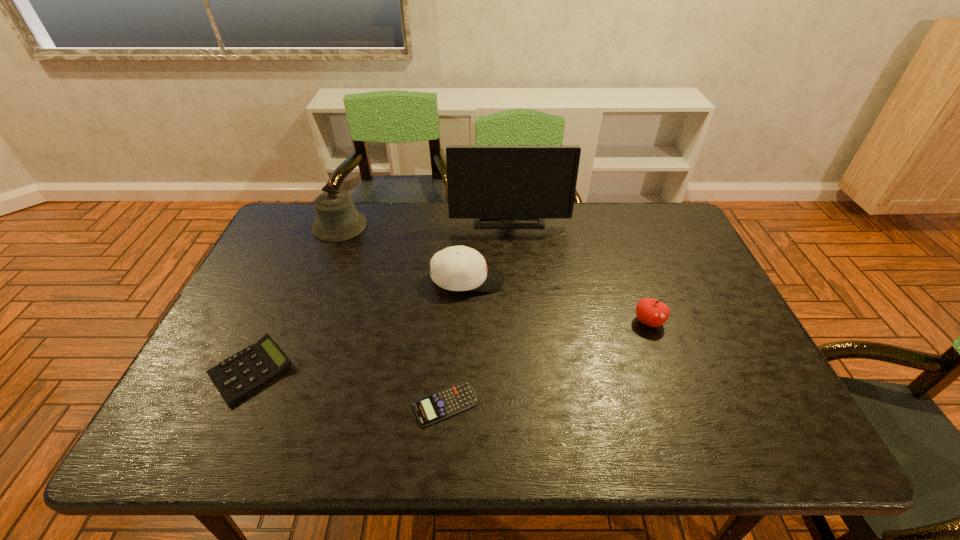
Where is `computer monitor`? The image size is (960, 540). computer monitor is located at coordinates (484, 182).

Find the location of a particular element. The image size is (960, 540). the fifth shortest object is located at coordinates (337, 219).

The width and height of the screenshot is (960, 540). I want to click on the fourth nearest object, so pyautogui.click(x=457, y=268).

This screenshot has height=540, width=960. What are the coordinates of `baseball cap` in the screenshot? It's located at (457, 268).

At what (x,y) coordinates should I click in order to perform the action: click on the rightmost object. Please return your answer as a coordinate pair (x, y). This screenshot has width=960, height=540. Looking at the image, I should click on (653, 313).

Where is `the fourth tallest object`? This screenshot has height=540, width=960. the fourth tallest object is located at coordinates (653, 313).

You are a GUI agent. You are given a task and a screenshot of the screen. Output one action in this format:
    pyautogui.click(x=<x>, y=<y>)
    Task: Click on the taller calculator
    This screenshot has width=960, height=540.
    Given the screenshot: What is the action you would take?
    pyautogui.click(x=241, y=374)

The image size is (960, 540). I want to click on the left calculator, so click(x=241, y=374).

Locate an element on the screen. The height and width of the screenshot is (540, 960). the right calculator is located at coordinates (447, 402).

Image resolution: width=960 pixels, height=540 pixels. What are the coordinates of `the shortest object` in the screenshot? It's located at (447, 402).